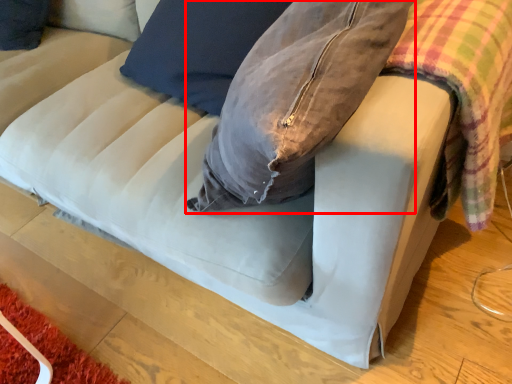
Question: From the image's perspective, where is bean bag chair (annotated by the red box) located relative to plaid?

Choices:
 (A) below
 (B) above

Answer: (B)